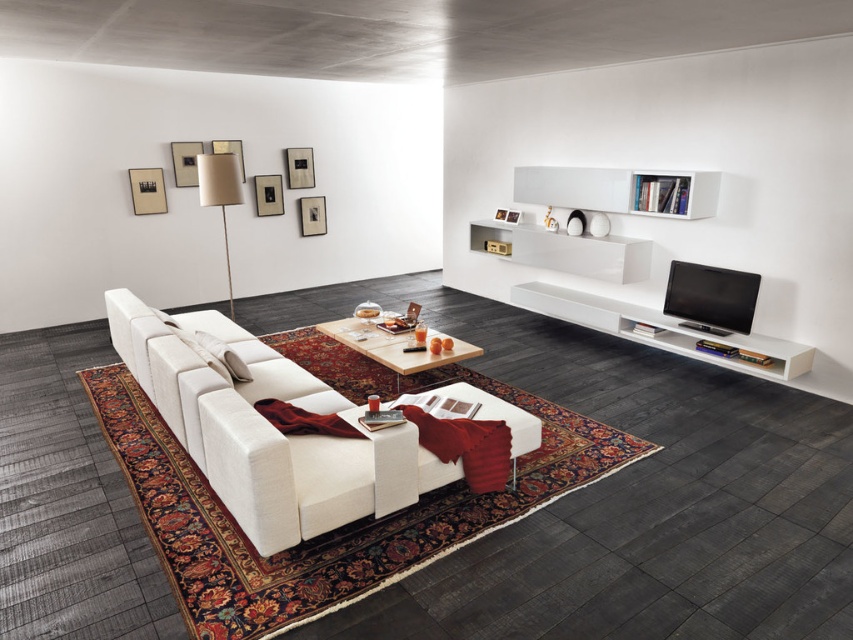
Between white fabric couch at center and wooden coffee table at center, which one is positioned lower?

white fabric couch at center

Is white fabric couch at center smaller than wooden coffee table at center?

Actually, white fabric couch at center might be larger than wooden coffee table at center.

Does point (200, 384) lie in front of point (386, 340)?

Yes.

Identify the location of white fabric couch at center. (268, 432).

Does white glossy bookshelf at upper center come behind white fabric pillow at center?

Yes, white glossy bookshelf at upper center is behind white fabric pillow at center.

Is point (651, 189) positioned behind point (204, 346)?

Yes.

Describe the element at coordinates (619, 189) in the screenshot. I see `white glossy bookshelf at upper center` at that location.

Image resolution: width=853 pixels, height=640 pixels. In order to click on white glossy bookshelf at upper center in this screenshot , I will do `click(619, 189)`.

Does white glossy bookshelf at upper center lie behind wooden coffee table at center?

Yes, white glossy bookshelf at upper center is further from the viewer.

Which is behind, point (543, 168) or point (375, 355)?

The point (543, 168) is behind.

I want to click on white glossy bookshelf at upper center, so click(x=619, y=189).